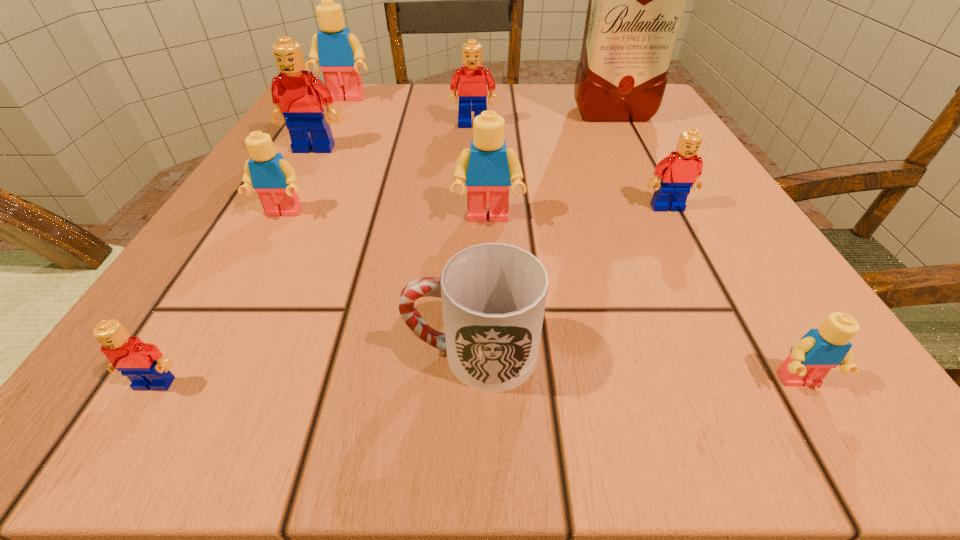
The height and width of the screenshot is (540, 960). I want to click on object that is positioned at the far right corner, so click(637, 0).

Identify the location of object present at the near right corner. The width and height of the screenshot is (960, 540). (819, 350).

Identify the location of vacant area at the far edge. The width and height of the screenshot is (960, 540). (567, 114).

The image size is (960, 540). What are the coordinates of `vacant region at the near edge of the desktop` in the screenshot? It's located at (669, 414).

Locate an element on the screen. This screenshot has height=540, width=960. vacant space at the left edge of the desktop is located at coordinates (318, 205).

Find the location of a particular element. vacant region at the right edge of the desktop is located at coordinates (617, 141).

Find the location of `vacant space at the far left corner`. vacant space at the far left corner is located at coordinates (349, 107).

Find the location of `vacant area between the third red Lego from left to right and the tallest object`. vacant area between the third red Lego from left to right and the tallest object is located at coordinates (542, 119).

Where is `vacant area that lies between the tallest object and the second smallest red Lego`? This screenshot has width=960, height=540. vacant area that lies between the tallest object and the second smallest red Lego is located at coordinates (639, 160).

Where is `vacant area that lies between the rightmost yellow Lego and the biggest yellow Lego`? The height and width of the screenshot is (540, 960). vacant area that lies between the rightmost yellow Lego and the biggest yellow Lego is located at coordinates (572, 240).